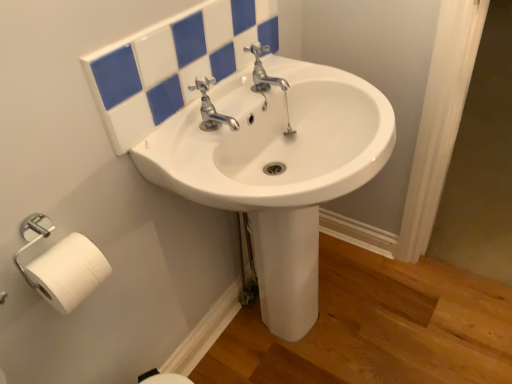
I want to click on free spot in front of chrome metallic faucet at center, so click(212, 172).